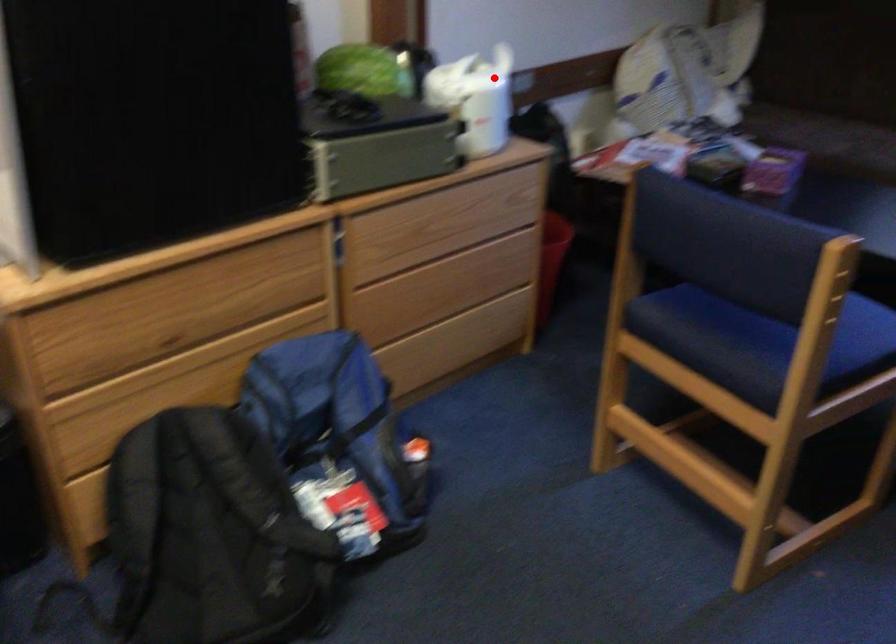
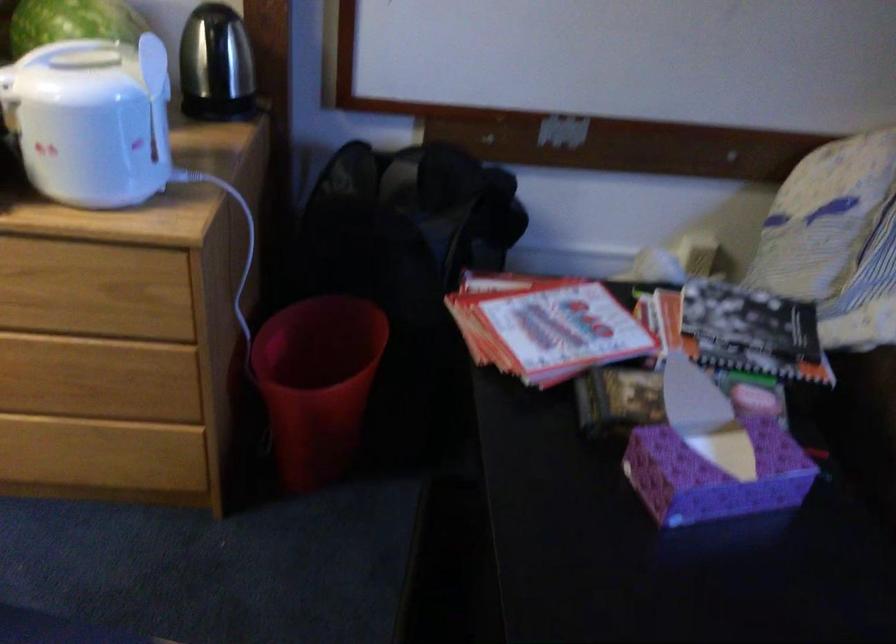
In the second image, find the point that corresponds to the highlighted location in the first image.

(156, 97)